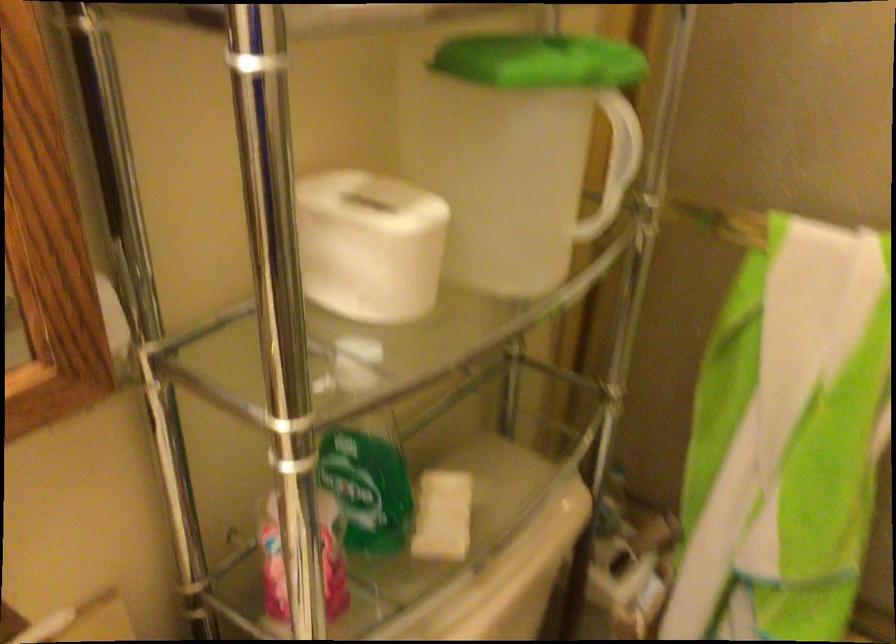
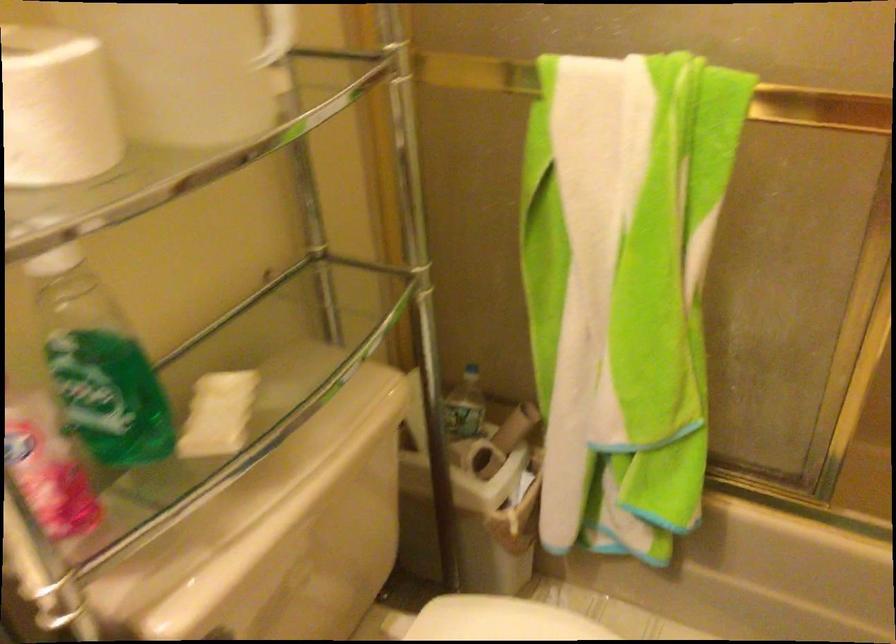
Question: Based on the continuous images, in which direction is the camera rotating? Reply with the corresponding letter.

Choices:
 (A) Left
 (B) Right
 (C) Up
 (D) Down

Answer: (B)